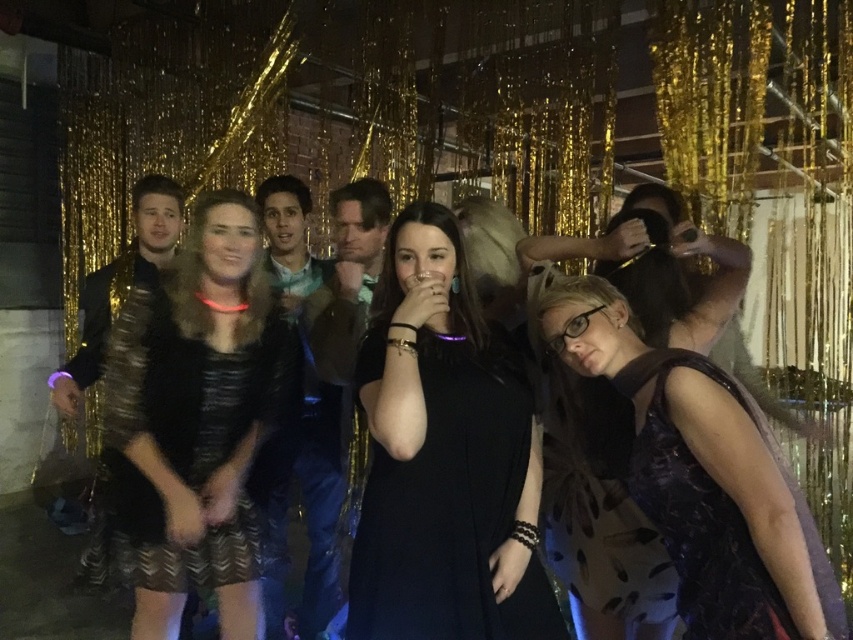
You are planning to wear a outfit similar to the ones in the image. You want to choose the wider one between the matte black dress at center and the shiny blue shirt at center. Which one should you pick?

The matte black dress at center is wider than the shiny blue shirt at center, so you should pick the matte black dress at center.

In the festive indoor scene with gold tinsel on the wall, there are two outfits in the center area. The first is a black matte dress at center and the second is a shiny blue jacket at center. Which of these two outfits is positioned to the right side?

The black matte dress at center is to the right of the shiny blue jacket at center, so the black matte dress at center is positioned to the right side.

You are at a party and want to hand a drink to the person in the shiny blue jacket at center without moving closer than 30 inches. Can you reach them from where you are standing near the black matte dress at center?

The distance between the black matte dress at center and the shiny blue jacket at center is 30.52 inches, so you can reach them without moving closer than 30 inches since the distance is slightly more than 30 inches.